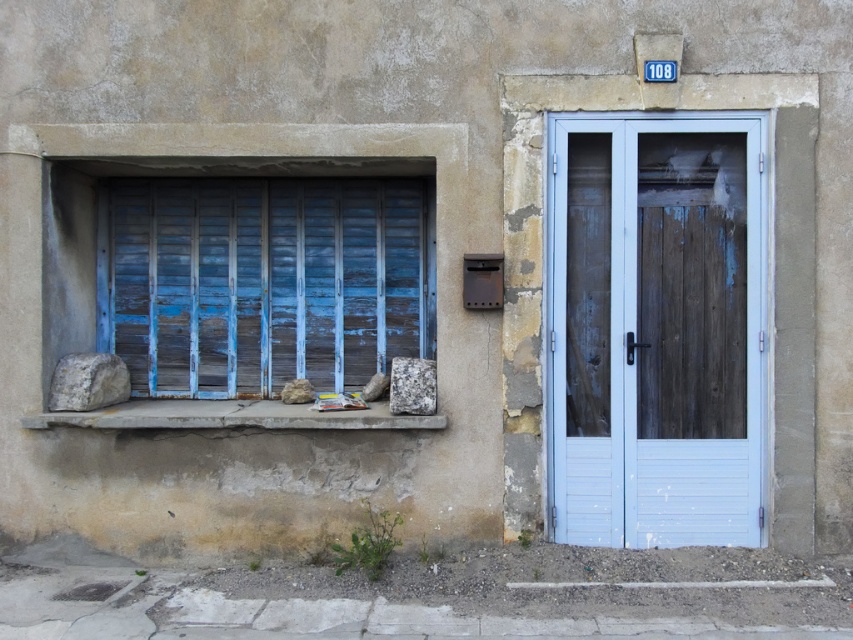
Who is taller, light blue wood door at center or granite rock at lower center?

light blue wood door at center

What do you see at coordinates (657, 332) in the screenshot?
I see `light blue wood door at center` at bounding box center [657, 332].

Where is `light blue wood door at center`? light blue wood door at center is located at coordinates (657, 332).

Is point (677, 356) more distant than point (148, 273)?

No, (677, 356) is closer to viewer.

Is point (660, 435) positioned in front of point (312, 323)?

Yes, point (660, 435) is in front of point (312, 323).

Where is `light blue wood door at center`? This screenshot has width=853, height=640. light blue wood door at center is located at coordinates (657, 332).

Consider the image. Between blue wooden shutters at left and granite rock at lower center, which one appears on the right side from the viewer's perspective?

Positioned to the right is granite rock at lower center.

Is point (149, 362) positioned behind point (422, 365)?

Yes, point (149, 362) is farther from viewer.

Where is `blue wooden shutters at left`? The width and height of the screenshot is (853, 640). blue wooden shutters at left is located at coordinates (267, 282).